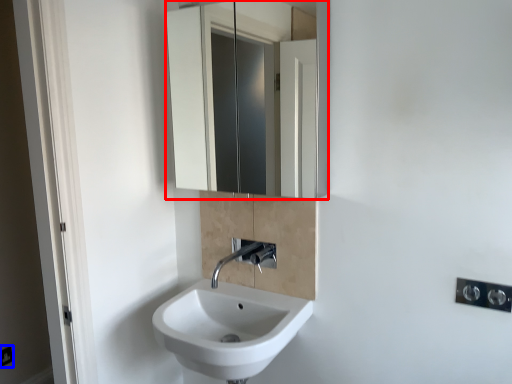
Question: Among these objects, which one is nearest to the camera, mirror (highlighted by a red box) or electric outlet (highlighted by a blue box)?

Choices:
 (A) mirror
 (B) electric outlet

Answer: (A)